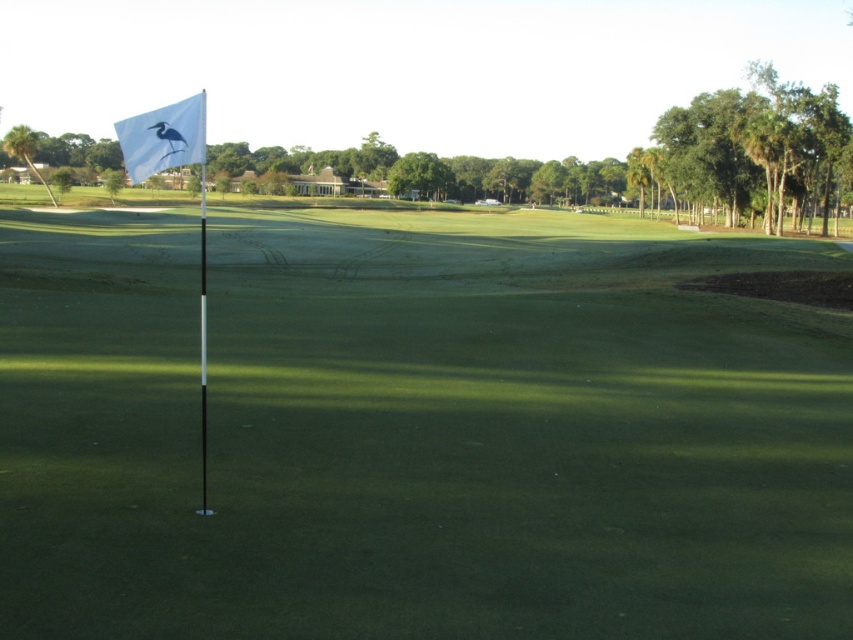
Is the position of white plastic flag at upper left less distant than that of white fabric flag at upper left?

Yes, it is in front of white fabric flag at upper left.

Who is more forward, (614,636) or (170,156)?

Positioned in front is point (614,636).

I want to click on white plastic flag at upper left, so [x=416, y=429].